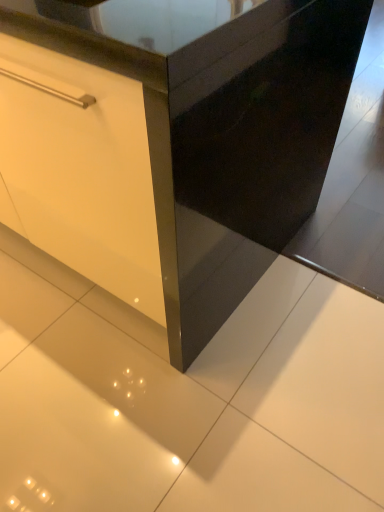
I want to click on glossy black cabinet at center, so click(x=225, y=138).

Describe the element at coordinates (225, 138) in the screenshot. This screenshot has width=384, height=512. I see `glossy black cabinet at center` at that location.

You are a GUI agent. You are given a task and a screenshot of the screen. Output one action in this format:
    pyautogui.click(x=<x>, y=<y>)
    Task: Click on the glossy black cabinet at center
    
    Given the screenshot: What is the action you would take?
    pyautogui.click(x=225, y=138)